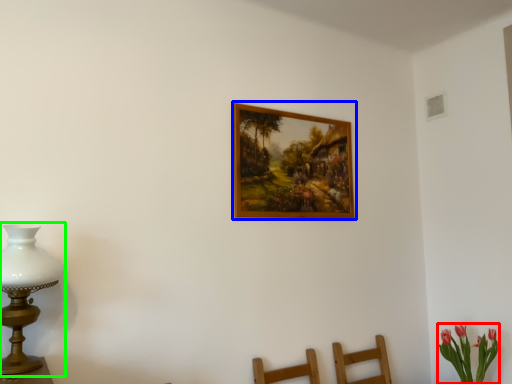
Question: Which is nearer to the floral arrangement (highlighted by a red box)? picture frame (highlighted by a blue box) or table lamp (highlighted by a green box).

Choices:
 (A) picture frame
 (B) table lamp

Answer: (A)